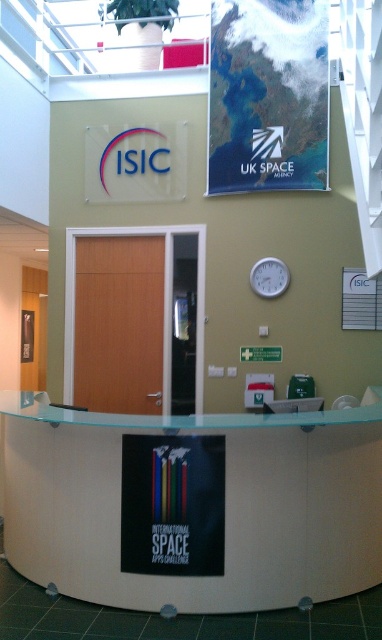
You are an event coordinator who needs to ensure all signage is visible. Given that the matte paper poster at upper center and the white plastic clock at center are both on the same wall, which one takes up more horizontal space?

The matte paper poster at upper center takes up more horizontal space since its width is larger than the white plastic clock at center.

You are a visitor at the space center and want to check the time using the white plastic clock at center. Where should you look relative to the white glossy information desk at center?

The white glossy information desk at center is positioned on the left side of the white plastic clock at center, so you should look to the right of the white glossy information desk at center to find the white plastic clock at center.